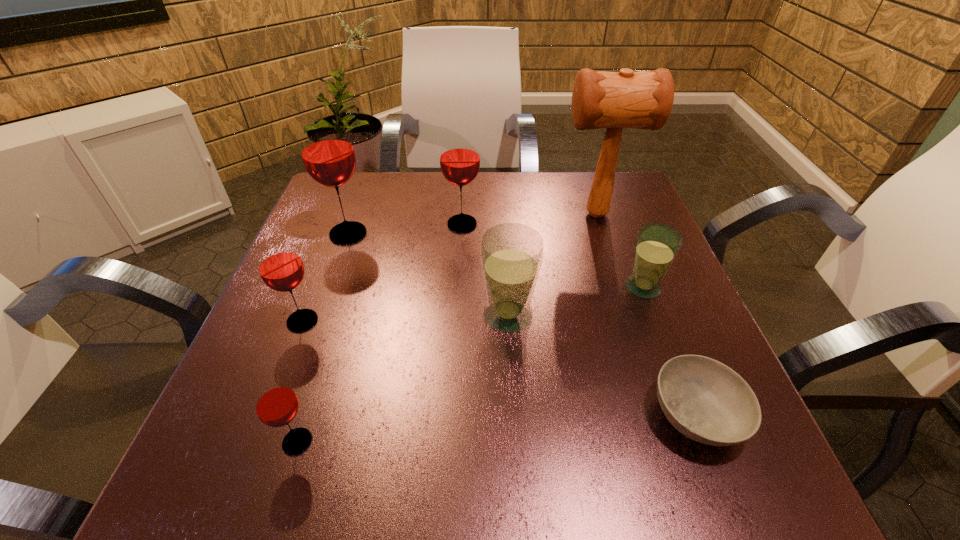
The width and height of the screenshot is (960, 540). I want to click on mallet, so click(626, 99).

The image size is (960, 540). What are the coordinates of `the tallest glass` in the screenshot? It's located at point(327,151).

Find the location of a particular element. Image resolution: width=960 pixels, height=540 pixels. the biggest red glass is located at coordinates (327, 151).

At what (x,y) coordinates should I click in order to perform the action: click on the second tallest glass. Please return your answer as a coordinate pair (x, y). The width and height of the screenshot is (960, 540). Looking at the image, I should click on [x=459, y=158].

Find the location of a particular element. The height and width of the screenshot is (540, 960). the third smallest red glass is located at coordinates (459, 158).

Locate an element on the screen. The height and width of the screenshot is (540, 960). the second smallest red glass is located at coordinates (279, 264).

Locate an element on the screen. The height and width of the screenshot is (540, 960). the left blue glass is located at coordinates (511, 253).

This screenshot has height=540, width=960. I want to click on the right blue glass, so click(657, 245).

Locate an element on the screen. the smaller blue glass is located at coordinates (657, 245).

Find the location of `the nearest glass`. the nearest glass is located at coordinates (276, 404).